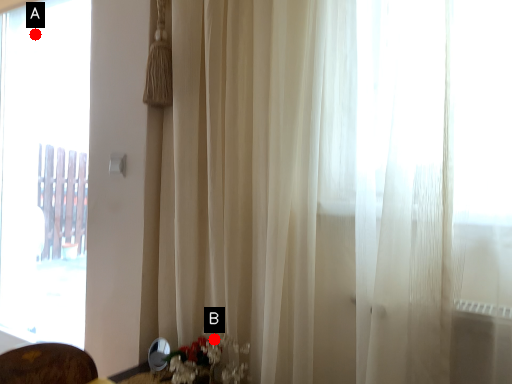
Question: Two points are circled on the image, labeled by A and B beside each circle. Among these points, which one is nearest to the camera?

Choices:
 (A) A is closer
 (B) B is closer

Answer: (B)